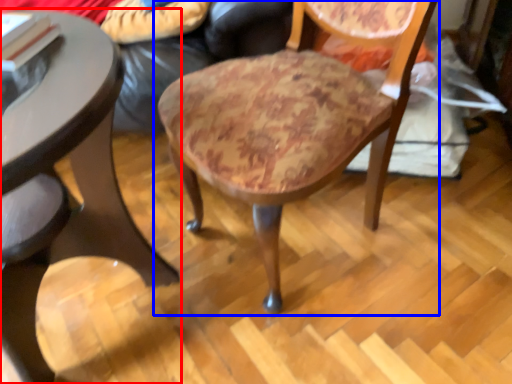
Question: Which of the following is the closest to the observer, table (highlighted by a red box) or chair (highlighted by a blue box)?

Choices:
 (A) table
 (B) chair

Answer: (A)